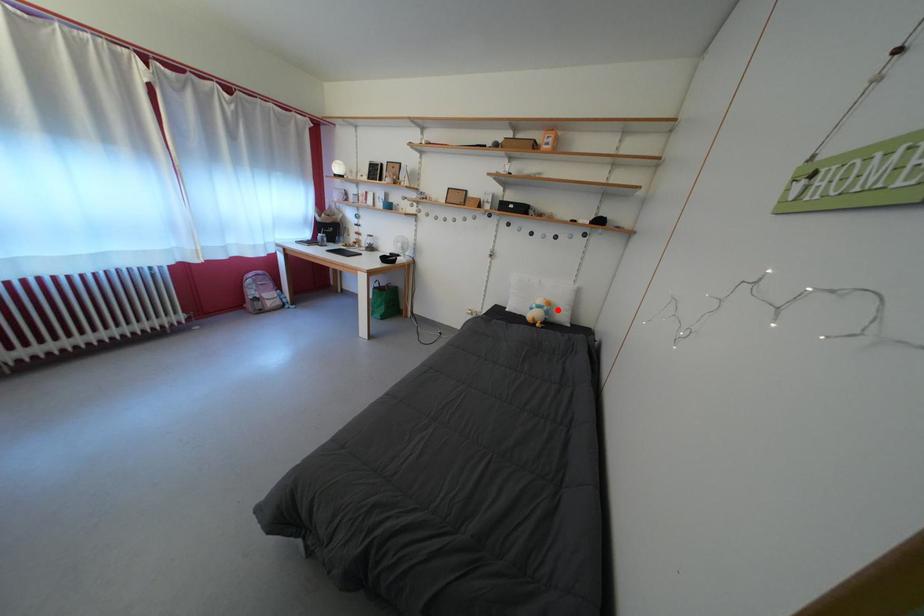
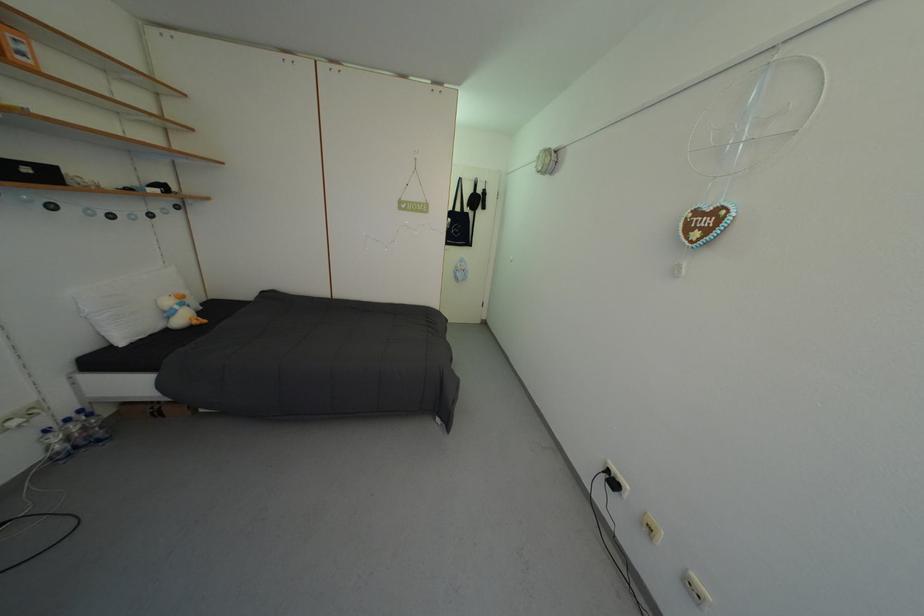
In the second image, find the point that corresponds to the highlighted location in the first image.

(190, 302)